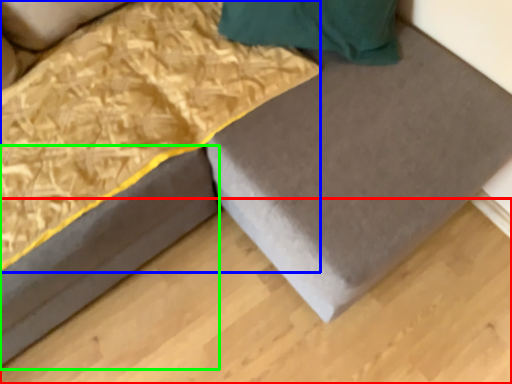
Question: Estimate the real-world distances between objects in this image. Which object is closer to plywood (highlighted by a red box), blanket (highlighted by a blue box) or bed frame (highlighted by a green box)?

Choices:
 (A) blanket
 (B) bed frame

Answer: (B)